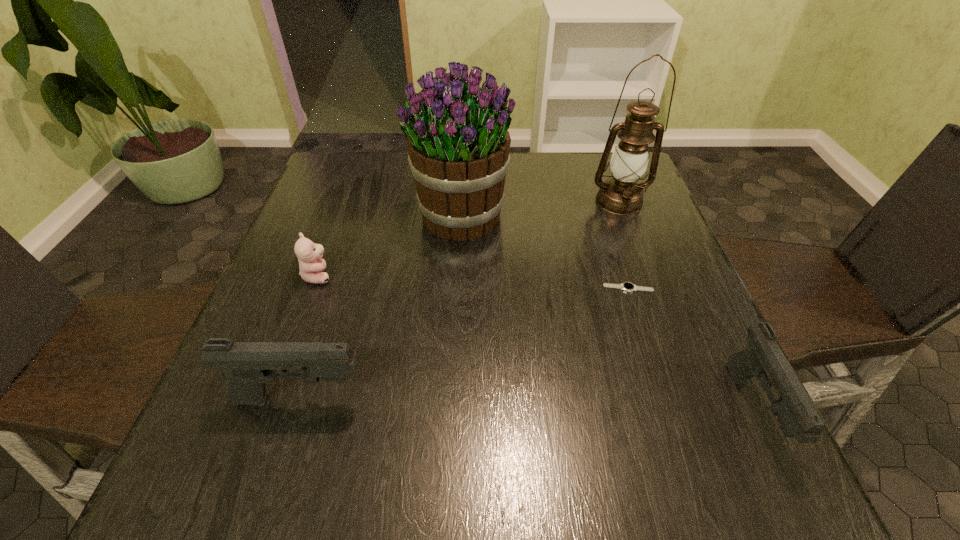
Where is `object that is at the near left corner`? object that is at the near left corner is located at coordinates (249, 365).

Where is `object that is at the far right corner`? The width and height of the screenshot is (960, 540). object that is at the far right corner is located at coordinates (622, 195).

This screenshot has width=960, height=540. Find the location of `object that is at the near right corner`. object that is at the near right corner is located at coordinates (763, 358).

I want to click on vacant space at the far edge, so click(381, 176).

Image resolution: width=960 pixels, height=540 pixels. Identify the location of free space at the right edge of the desktop. 695,356.

You are a GUI agent. You are given a task and a screenshot of the screen. Output one action in this format:
    pyautogui.click(x=<x>, y=<y>)
    Task: Click on the vacant space at the far left corner of the desktop
    
    Given the screenshot: What is the action you would take?
    pyautogui.click(x=329, y=193)

Identify the location of free space at the far right corner of the desktop. The width and height of the screenshot is (960, 540). (584, 179).

This screenshot has height=540, width=960. Identify the location of free point between the third tallest object and the fourth tallest object. (527, 404).

Where is `vacant region between the oil lamp and the third shortest object`? The image size is (960, 540). vacant region between the oil lamp and the third shortest object is located at coordinates (685, 306).

You are a GUI agent. You are given a task and a screenshot of the screen. Output one action in this format:
    pyautogui.click(x=<x>, y=<y>)
    Task: Click on the free space between the teddy bear and the right pistol
    The image size is (960, 540).
    Given the screenshot: What is the action you would take?
    pyautogui.click(x=536, y=343)